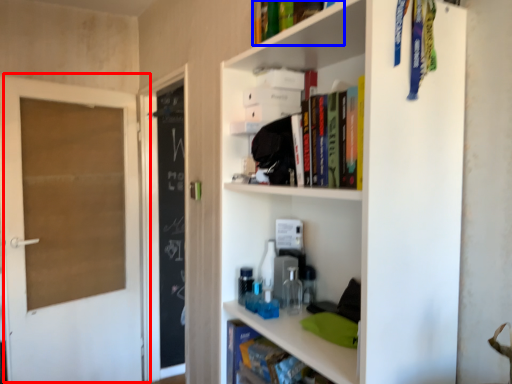
Question: Which point is closer to the camera, door (highlighted by a red box) or book (highlighted by a blue box)?

Choices:
 (A) door
 (B) book

Answer: (B)